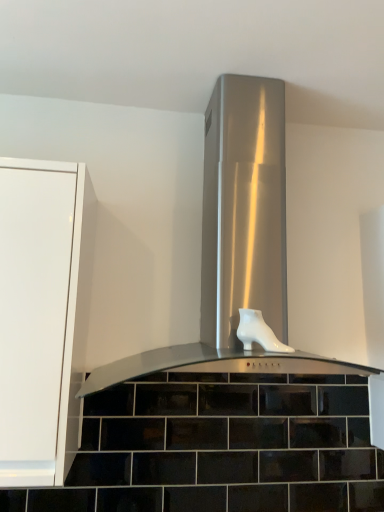
Locate an element on the screen. The height and width of the screenshot is (512, 384). white glossy boot at center is located at coordinates (258, 332).

What do you see at coordinates (258, 332) in the screenshot? I see `white glossy boot at center` at bounding box center [258, 332].

I want to click on stainless steel range hood at center, so click(293, 222).

Describe the element at coordinates (293, 222) in the screenshot. I see `stainless steel range hood at center` at that location.

Where is `white glossy boot at center`? The width and height of the screenshot is (384, 512). white glossy boot at center is located at coordinates (258, 332).

Can you confirm if white glossy boot at center is positioned to the left of stainless steel range hood at center?

No, white glossy boot at center is not to the left of stainless steel range hood at center.

Who is more distant, white glossy boot at center or stainless steel range hood at center?

white glossy boot at center.

Between point (251, 330) and point (230, 98), which one is positioned behind?

The point (230, 98) is more distant.

Based on the photo, from the image's perspective, between white glossy boot at center and stainless steel range hood at center, which one is located above?

From the image's view, stainless steel range hood at center is above.

From a real-world perspective, which is physically below, white glossy boot at center or stainless steel range hood at center?

From a 3D spatial view, white glossy boot at center is below.

Which object is thinner, white glossy boot at center or stainless steel range hood at center?

white glossy boot at center is thinner.

Does white glossy boot at center have a lesser height compared to stainless steel range hood at center?

Yes, white glossy boot at center is shorter than stainless steel range hood at center.

Is white glossy boot at center bigger than stainless steel range hood at center?

No, white glossy boot at center is not bigger than stainless steel range hood at center.

Would you say white glossy boot at center contains stainless steel range hood at center?

No, stainless steel range hood at center is not inside white glossy boot at center.

Would you say white glossy boot at center is a long distance from stainless steel range hood at center?

No, white glossy boot at center is not far from stainless steel range hood at center.

Could you tell me if white glossy boot at center is facing stainless steel range hood at center?

Yes.

How many degrees apart are the facing directions of white glossy boot at center and stainless steel range hood at center?

0.0994 degrees separate the facing orientations of white glossy boot at center and stainless steel range hood at center.

What are the coordinates of `footwear below the stainless steel range hood at center (from a real-world perspective)` in the screenshot? It's located at (258, 332).

Is stainless steel range hood at center to the left or to the right of white glossy boot at center in the image?

Clearly, stainless steel range hood at center is on the left of white glossy boot at center in the image.

Is stainless steel range hood at center behind white glossy boot at center?

No, stainless steel range hood at center is in front of white glossy boot at center.

Is point (209, 162) positioned in front of point (261, 331)?

No, it is not.

In the scene shown: From the image's perspective, is stainless steel range hood at center located beneath white glossy boot at center?

No.

From a real-world perspective, is stainless steel range hood at center below white glossy boot at center?

Actually, stainless steel range hood at center is physically above white glossy boot at center in the real world.

Considering the sizes of stainless steel range hood at center and white glossy boot at center in the image, is stainless steel range hood at center wider or thinner than white glossy boot at center?

In the image, stainless steel range hood at center appears to be wider than white glossy boot at center.

Does stainless steel range hood at center have a lesser height compared to white glossy boot at center?

No.

Considering the relative sizes of stainless steel range hood at center and white glossy boot at center in the image provided, is stainless steel range hood at center smaller than white glossy boot at center?

Incorrect, stainless steel range hood at center is not smaller in size than white glossy boot at center.

Is stainless steel range hood at center spatially inside white glossy boot at center, or outside of it?

stainless steel range hood at center is spatially situated outside white glossy boot at center.

Can you see stainless steel range hood at center touching white glossy boot at center?

No, stainless steel range hood at center is not beside white glossy boot at center.

Is white glossy boot at center at the back of stainless steel range hood at center?

Correct, stainless steel range hood at center is looking away from white glossy boot at center.

How many degrees apart are the facing directions of stainless steel range hood at center and white glossy boot at center?

There is a 0.0994-degree angle between the facing directions of stainless steel range hood at center and white glossy boot at center.

Identify the location of footwear behind the stainless steel range hood at center. (258, 332).

Identify the location of footwear below the stainless steel range hood at center (from the image's perspective). The height and width of the screenshot is (512, 384). (258, 332).

I want to click on home appliance above the white glossy boot at center (from the image's perspective), so click(x=293, y=222).